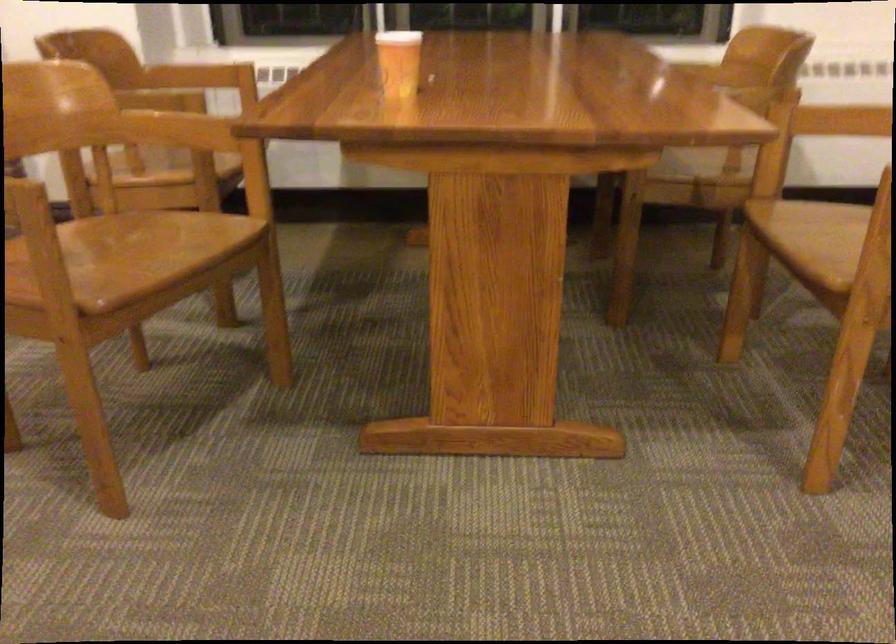
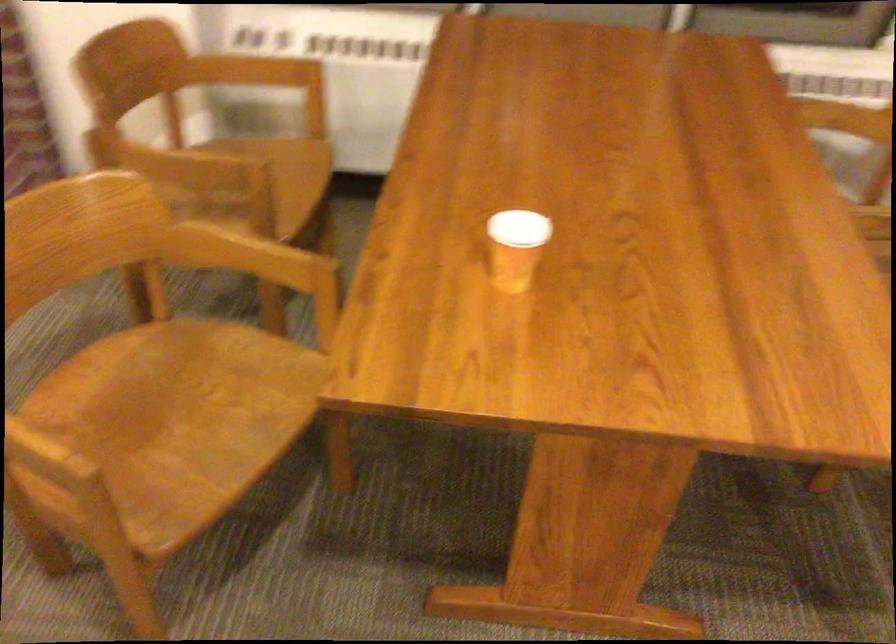
Locate, in the second image, the point that corresponds to point 116,257 in the first image.

(170, 424)